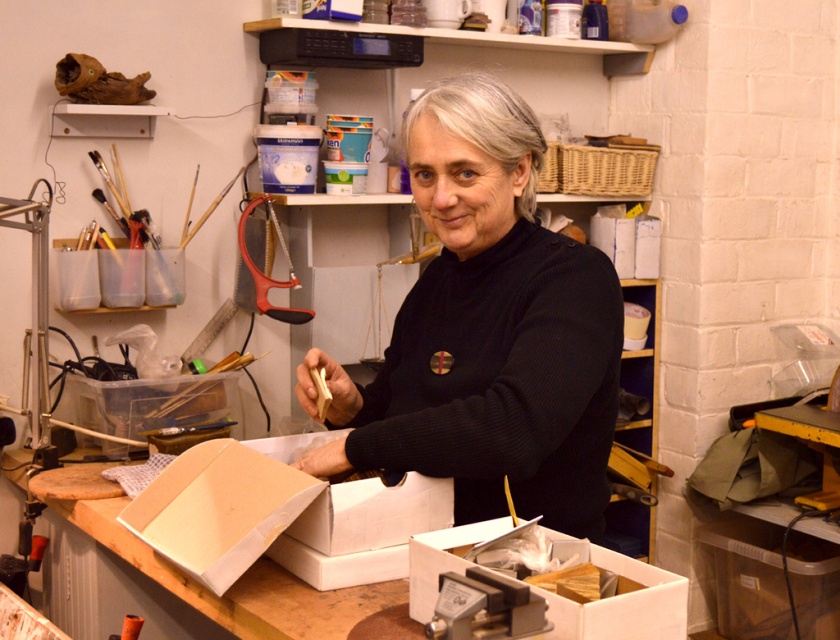
Question: Considering the real-world distances, which object is farthest from the black woolen sweater at center?

Choices:
 (A) white cardboard box at lower center
 (B) white cardboard box at center
 (C) wooden table at center

Answer: (C)

Question: Is wooden table at center positioned behind white cardboard box at lower center?

Choices:
 (A) no
 (B) yes

Answer: (B)

Question: Does white cardboard box at center lie in front of white cardboard box at lower center?

Choices:
 (A) yes
 (B) no

Answer: (B)

Question: Considering the real-world distances, which object is farthest from the white cardboard box at lower center?

Choices:
 (A) wooden table at center
 (B) white cardboard box at center

Answer: (A)

Question: Is black woolen sweater at center below white cardboard box at center?

Choices:
 (A) yes
 (B) no

Answer: (B)

Question: Which of the following is the closest to the observer?

Choices:
 (A) (357, 595)
 (B) (487, 305)
 (C) (628, 560)

Answer: (C)